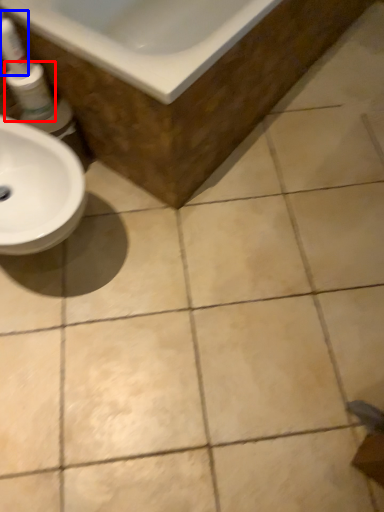
Question: Which object appears farthest to the camera in this image, mouthwash (highlighted by a red box) or cleaning product (highlighted by a blue box)?

Choices:
 (A) mouthwash
 (B) cleaning product

Answer: (A)